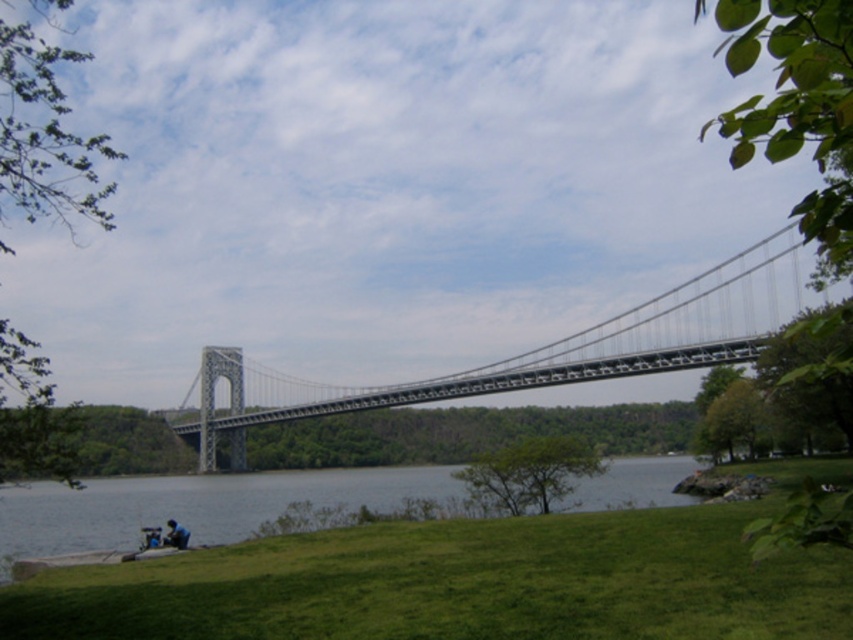
Question: Among these objects, which one is farthest from the camera?

Choices:
 (A) gray concrete water at lower center
 (B) blue denim jacket at lower left

Answer: (B)

Question: Does green grassy at lower center have a lesser width compared to gray concrete water at lower center?

Choices:
 (A) no
 (B) yes

Answer: (B)

Question: Does green grassy at lower center appear on the left side of blue denim jacket at lower left?

Choices:
 (A) no
 (B) yes

Answer: (A)

Question: Which point is farther to the camera?

Choices:
 (A) (144, 531)
 (B) (408, 384)

Answer: (B)

Question: Among these objects, which one is farthest from the camera?

Choices:
 (A) green grassy at lower center
 (B) gray metallic suspension bridge at center

Answer: (B)

Question: Does green grassy at lower center appear over gray concrete water at lower center?

Choices:
 (A) yes
 (B) no

Answer: (A)